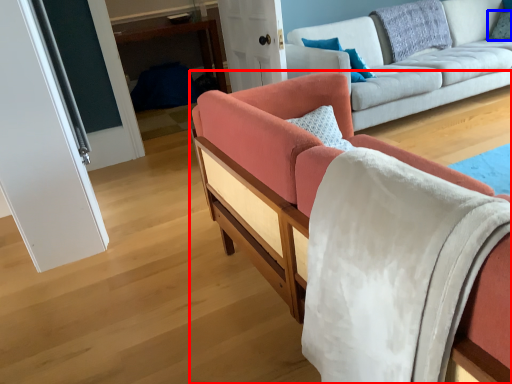
Question: Which object is closer to the camera taking this photo, studio couch (highlighted by a red box) or pillow (highlighted by a blue box)?

Choices:
 (A) studio couch
 (B) pillow

Answer: (A)